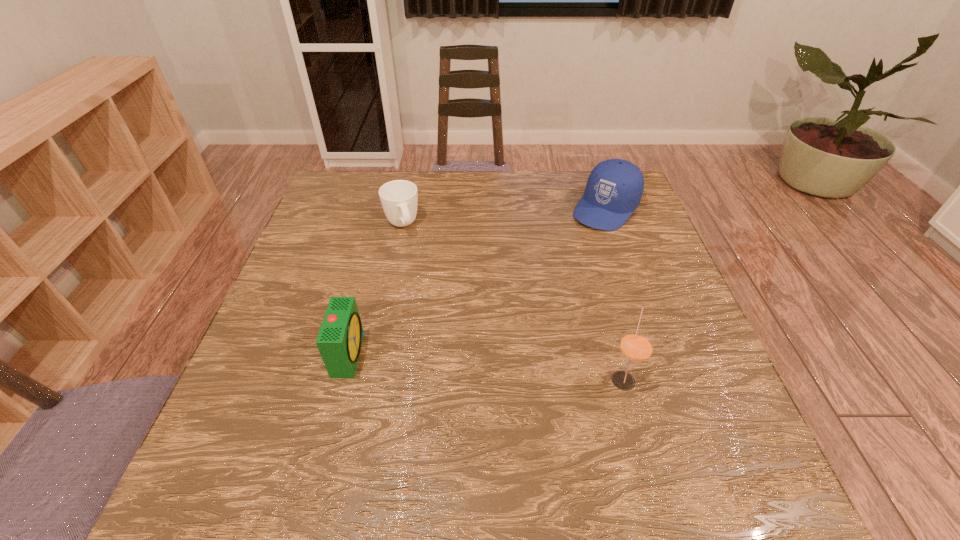
Image resolution: width=960 pixels, height=540 pixels. Identify the location of vacant region at the far left corner. (360, 210).

Locate an element on the screen. The image size is (960, 540). free point at the near left corner is located at coordinates 261,426.

Identify the location of free area in between the straw and the alarm clock. [x=486, y=366].

Identify the location of vacant area between the alarm clock and the tallest object. Image resolution: width=960 pixels, height=540 pixels. (486, 366).

Locate an element on the screen. The image size is (960, 540). unoccupied position between the cap and the tallest object is located at coordinates (614, 294).

At what (x,y) coordinates should I click in order to perform the action: click on vacant area that lies between the cap and the alarm clock. Please return your answer as a coordinate pair (x, y). This screenshot has height=540, width=960. Looking at the image, I should click on (477, 281).

Image resolution: width=960 pixels, height=540 pixels. In order to click on free area in between the cup and the alarm clock in this screenshot , I will do `click(375, 289)`.

In order to click on free space between the straw and the alarm clock in this screenshot , I will do `click(486, 366)`.

The width and height of the screenshot is (960, 540). In order to click on unoccupied area between the alarm clock and the cap in this screenshot , I will do `click(477, 281)`.

At what (x,y) coordinates should I click in order to perform the action: click on unoccupied position between the cup and the cap. Please return your answer as a coordinate pair (x, y). Looking at the image, I should click on (504, 217).